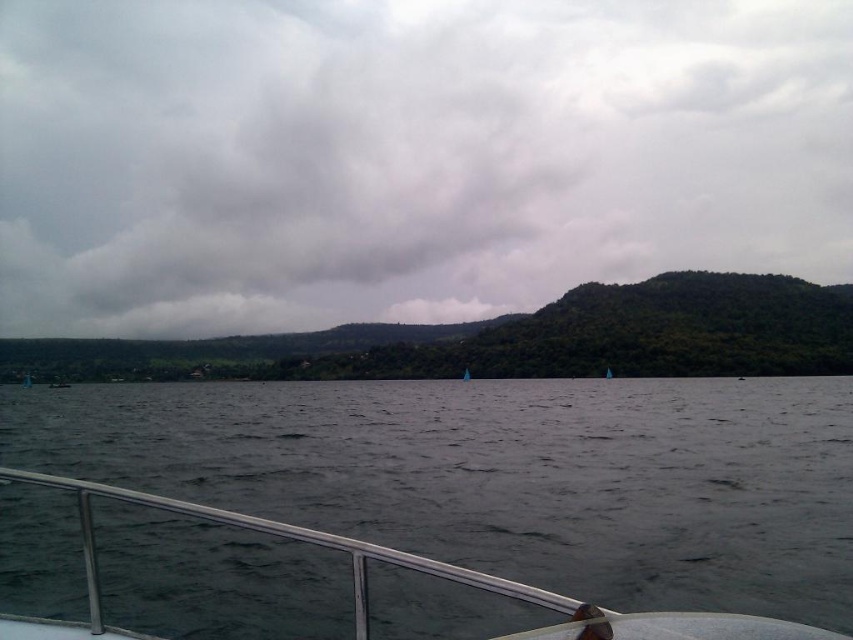
Does point (547, 129) come farther from viewer compared to point (439, 516)?

That is True.

Which of these two, cloudy sky at upper center or dark gray water at center, stands taller?

cloudy sky at upper center is taller.

Does point (309, 195) come farther from viewer compared to point (548, 496)?

That is True.

At what (x,y) coordinates should I click in order to perform the action: click on cloudy sky at upper center. Please return your answer as a coordinate pair (x, y). Looking at the image, I should click on (405, 156).